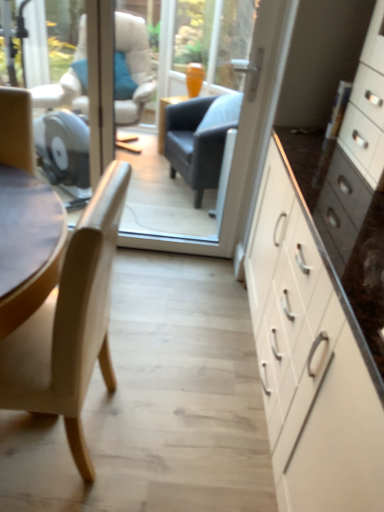
Question: Does light beige wood chair at left have a greater width compared to white glossy cabinet at right?

Choices:
 (A) yes
 (B) no

Answer: (B)

Question: Considering the relative sizes of light beige wood chair at left and white glossy cabinet at right in the image provided, is light beige wood chair at left bigger than white glossy cabinet at right?

Choices:
 (A) no
 (B) yes

Answer: (A)

Question: From a real-world perspective, does light beige wood chair at left stand above white glossy cabinet at right?

Choices:
 (A) no
 (B) yes

Answer: (A)

Question: From the image's perspective, is light beige wood chair at left on white glossy cabinet at right?

Choices:
 (A) yes
 (B) no

Answer: (B)

Question: Does light beige wood chair at left come behind white glossy cabinet at right?

Choices:
 (A) no
 (B) yes

Answer: (B)

Question: From the image's perspective, is transparent glass door at center positioned above or below white glossy cabinet at right?

Choices:
 (A) above
 (B) below

Answer: (A)

Question: Is transparent glass door at center to the left or to the right of white glossy cabinet at right in the image?

Choices:
 (A) right
 (B) left

Answer: (B)

Question: Considering the positions of transparent glass door at center and white glossy cabinet at right in the image, is transparent glass door at center taller or shorter than white glossy cabinet at right?

Choices:
 (A) tall
 (B) short

Answer: (B)

Question: Is transparent glass door at center spatially inside white glossy cabinet at right, or outside of it?

Choices:
 (A) inside
 (B) outside

Answer: (B)

Question: From a real-world perspective, is white glossy cabinet at right physically located above or below light beige wood chair at left?

Choices:
 (A) below
 (B) above

Answer: (B)

Question: Is white glossy cabinet at right inside or outside of light beige wood chair at left?

Choices:
 (A) outside
 (B) inside

Answer: (A)

Question: From the image's perspective, is white glossy cabinet at right located above or below light beige wood chair at left?

Choices:
 (A) below
 (B) above

Answer: (B)

Question: In the image, is white glossy cabinet at right on the left side or the right side of light beige wood chair at left?

Choices:
 (A) right
 (B) left

Answer: (A)

Question: Looking at the image, does light beige wood chair at left seem bigger or smaller compared to transparent glass door at center?

Choices:
 (A) big
 (B) small

Answer: (A)

Question: From the image's perspective, relative to transparent glass door at center, is light beige wood chair at left above or below?

Choices:
 (A) above
 (B) below

Answer: (B)